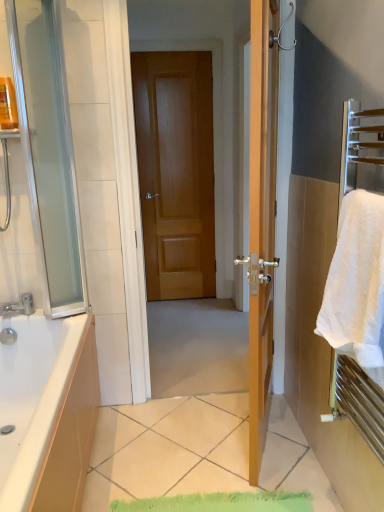
Describe the element at coordinates (357, 285) in the screenshot. I see `white fluffy towel at right` at that location.

The width and height of the screenshot is (384, 512). Describe the element at coordinates (176, 170) in the screenshot. I see `wooden door at center` at that location.

Image resolution: width=384 pixels, height=512 pixels. Find the location of `transparent glass screen door at left`. transparent glass screen door at left is located at coordinates (48, 152).

Does brushed metal faucet at lower left appear on the right side of white glossy tile at center?

Incorrect, brushed metal faucet at lower left is not on the right side of white glossy tile at center.

Could you tell me if brushed metal faucet at lower left is facing white glossy tile at center?

No, brushed metal faucet at lower left does not turn towards white glossy tile at center.

From the image's perspective, between brushed metal faucet at lower left and white glossy tile at center, who is located below?

white glossy tile at center.

Locate an element on the screen. tile below the brushed metal faucet at lower left (from a real-world perspective) is located at coordinates click(x=169, y=449).

At what (x,y) coordinates should I click in order to perform the action: click on door above the white fluffy towel at right (from the image's perspective). Please return your answer as a coordinate pair (x, y). Looking at the image, I should click on (176, 170).

In the scene shown: From the image's perspective, would you say white fluffy towel at right is shown under wooden door at center?

Correct, white fluffy towel at right appears lower than wooden door at center in the image.

Which object is wider, white fluffy towel at right or wooden door at center?

Wider between the two is white fluffy towel at right.

Locate an element on the screen. screen door located on the left of white glossy tile at center is located at coordinates (48, 152).

Which of these two, transparent glass screen door at left or white glossy tile at center, is thinner?

With smaller width is transparent glass screen door at left.

In terms of width, does translucent plastic bottle at upper left look wider or thinner when compared to white fluffy towel at right?

In the image, translucent plastic bottle at upper left appears to be more narrow than white fluffy towel at right.

Can you confirm if translucent plastic bottle at upper left is taller than white fluffy towel at right?

In fact, translucent plastic bottle at upper left may be shorter than white fluffy towel at right.

Considering the positions of point (9, 79) and point (347, 234), is point (9, 79) closer or farther from the camera than point (347, 234)?

Point (9, 79) is positioned farther from the camera compared to point (347, 234).

The image size is (384, 512). I want to click on toiletry above the white fluffy towel at right (from a real-world perspective), so click(8, 105).

From a real-world perspective, which object stands above the other?

translucent plastic bottle at upper left, from a real-world perspective.

Looking at this image, from their relative heights in the image, would you say white fluffy towel at right is taller or shorter than translucent plastic bottle at upper left?

In the image, white fluffy towel at right appears to be taller than translucent plastic bottle at upper left.

Looking at this image, which is behind, white fluffy towel at right or translucent plastic bottle at upper left?

translucent plastic bottle at upper left.

Is brushed metal faucet at lower left aimed at white fluffy towel at right?

No.

Which object is positioned more to the right, brushed metal faucet at lower left or white fluffy towel at right?

white fluffy towel at right is more to the right.

Which object is thinner, brushed metal faucet at lower left or white fluffy towel at right?

white fluffy towel at right.

Between brushed metal faucet at lower left and white fluffy towel at right, which one has more height?

Standing taller between the two is white fluffy towel at right.

Which object is positioned more to the left, translucent plastic bottle at upper left or transparent glass screen door at left?

translucent plastic bottle at upper left is more to the left.

Does translucent plastic bottle at upper left have a smaller size compared to transparent glass screen door at left?

Yes.

From the image's perspective, is translucent plastic bottle at upper left located above or below transparent glass screen door at left?

From the image's perspective, translucent plastic bottle at upper left appears above transparent glass screen door at left.

Does translucent plastic bottle at upper left have a greater width compared to transparent glass screen door at left?

Incorrect, the width of translucent plastic bottle at upper left does not surpass that of transparent glass screen door at left.

Locate an element on the screen. tap above the white glossy tile at center (from the image's perspective) is located at coordinates (19, 305).

Identify the location of beach towel below the wooden door at center (from the image's perspective). This screenshot has width=384, height=512. (357, 285).

Looking at the image, which one is located further to white glossy tile at center, transparent glass screen door at left or translucent plastic bottle at upper left?

translucent plastic bottle at upper left lies further to white glossy tile at center than the other object.

Looking at the image, which one is located further to wooden door at center, translucent plastic bottle at upper left or white fluffy towel at right?

white fluffy towel at right lies further to wooden door at center than the other object.

From the image, which object appears to be nearer to wooden door at center, white glossy tile at center or white fluffy towel at right?

The object closer to wooden door at center is white glossy tile at center.

Which object lies nearer to the anchor point transparent glass screen door at left, white glossy tile at center or white fluffy towel at right?

white glossy tile at center lies closer to transparent glass screen door at left than the other object.

When comparing their distances from white fluffy towel at right, does translucent plastic bottle at upper left or brushed metal faucet at lower left seem further?

Based on the image, translucent plastic bottle at upper left appears to be further to white fluffy towel at right.

Looking at the image, which one is located further to transparent glass screen door at left, brushed metal faucet at lower left or translucent plastic bottle at upper left?

brushed metal faucet at lower left lies further to transparent glass screen door at left than the other object.

Looking at the image, which one is located closer to brushed metal faucet at lower left, wooden door at center or white fluffy towel at right?

Among the two, white fluffy towel at right is located nearer to brushed metal faucet at lower left.

Estimate the real-world distances between objects in this image. Which object is further from white glossy tile at center, brushed metal faucet at lower left or translucent plastic bottle at upper left?

Based on the image, translucent plastic bottle at upper left appears to be further to white glossy tile at center.

You are a GUI agent. You are given a task and a screenshot of the screen. Output one action in this format:
    pyautogui.click(x=<x>, y=<y>)
    Task: Click on the screen door located between brushed metal faucet at lower left and white fluffy towel at right in the left-right direction
    Image resolution: width=384 pixels, height=512 pixels.
    Given the screenshot: What is the action you would take?
    pyautogui.click(x=48, y=152)

I want to click on beach towel between transparent glass screen door at left and white glossy tile at center vertically, so click(357, 285).

The image size is (384, 512). I want to click on toiletry between white glossy tile at center and wooden door at center from front to back, so click(8, 105).

Locate an element on the screen. The image size is (384, 512). tap between transparent glass screen door at left and white glossy tile at center vertically is located at coordinates (19, 305).